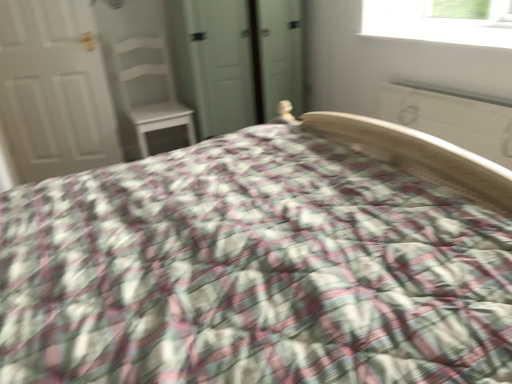
Question: From a real-world perspective, is green matte wardrobe at center under white smooth window sill at upper right?

Choices:
 (A) no
 (B) yes

Answer: (B)

Question: From a real-world perspective, is green matte wardrobe at center on top of white smooth window sill at upper right?

Choices:
 (A) yes
 (B) no

Answer: (B)

Question: Is green matte wardrobe at center far away from white smooth window sill at upper right?

Choices:
 (A) no
 (B) yes

Answer: (A)

Question: Is green matte wardrobe at center facing towards white smooth window sill at upper right?

Choices:
 (A) no
 (B) yes

Answer: (B)

Question: Is green matte wardrobe at center positioned in front of white smooth window sill at upper right?

Choices:
 (A) no
 (B) yes

Answer: (A)

Question: Is green matte wardrobe at center wider than white smooth window sill at upper right?

Choices:
 (A) no
 (B) yes

Answer: (B)

Question: Can you confirm if plaid fabric bed at center is wider than green matte wardrobe at center?

Choices:
 (A) no
 (B) yes

Answer: (B)

Question: Is plaid fabric bed at center shorter than green matte wardrobe at center?

Choices:
 (A) yes
 (B) no

Answer: (A)

Question: Does plaid fabric bed at center lie behind green matte wardrobe at center?

Choices:
 (A) yes
 (B) no

Answer: (B)

Question: Is plaid fabric bed at center to the right of green matte wardrobe at center from the viewer's perspective?

Choices:
 (A) no
 (B) yes

Answer: (B)

Question: Is plaid fabric bed at center not inside green matte wardrobe at center?

Choices:
 (A) no
 (B) yes

Answer: (B)

Question: From the image's perspective, does plaid fabric bed at center appear lower than green matte wardrobe at center?

Choices:
 (A) yes
 (B) no

Answer: (A)

Question: Is white wood chair at upper left not within plaid fabric bed at center?

Choices:
 (A) yes
 (B) no

Answer: (A)